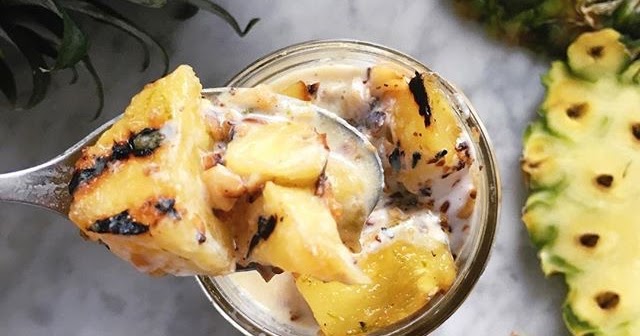
The width and height of the screenshot is (640, 336). Find the location of `spoon`. spoon is located at coordinates (28, 178).